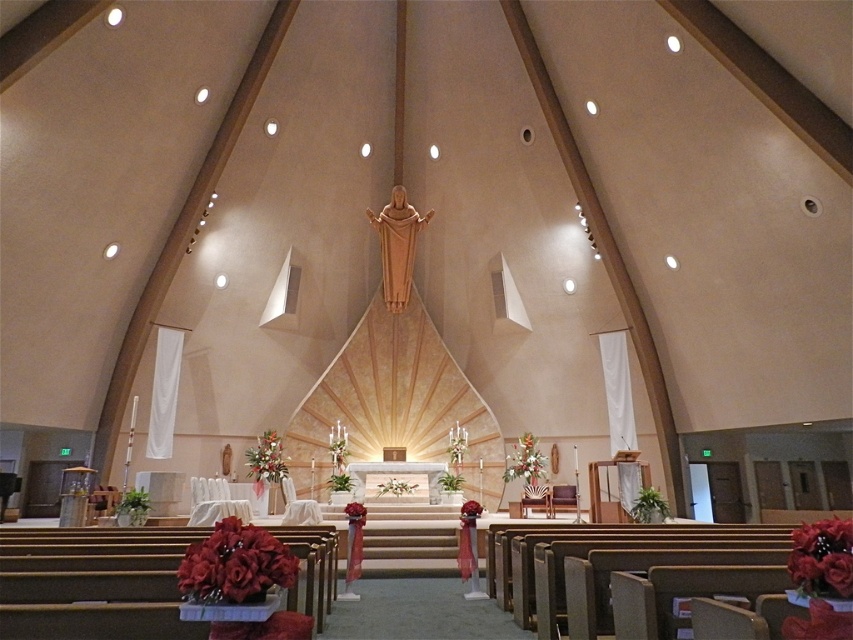
Which is behind, point (265, 572) or point (508, 480)?

The point (508, 480) is more distant.

Which is in front, point (219, 600) or point (520, 440)?

Positioned in front is point (219, 600).

Identify the location of velvety red bouquet at lower left. (234, 564).

In the scene shown: Between velvety red bouquet at lower left and silky red roses at lower right, which one has less height?

Standing shorter between the two is velvety red bouquet at lower left.

Who is positioned more to the left, velvety red bouquet at lower left or silky red roses at lower right?

velvety red bouquet at lower left

The image size is (853, 640). Describe the element at coordinates (234, 564) in the screenshot. I see `velvety red bouquet at lower left` at that location.

At what (x,y) coordinates should I click in order to perform the action: click on velvety red bouquet at lower left. Please return your answer as a coordinate pair (x, y). Image resolution: width=853 pixels, height=640 pixels. Looking at the image, I should click on (234, 564).

Between point (837, 577) and point (257, 461), which one is positioned behind?

The point (257, 461) is more distant.

Does silky red roses at lower right have a greater height compared to white silk flowers at lower center?

Incorrect, silky red roses at lower right's height is not larger of white silk flowers at lower center's.

Is point (831, 573) positioned after point (282, 465)?

No, (831, 573) is closer to viewer.

You are a GUI agent. You are given a task and a screenshot of the screen. Output one action in this format:
    pyautogui.click(x=<x>, y=<y>)
    Task: Click on the silky red roses at lower right
    Image resolution: width=853 pixels, height=640 pixels.
    Given the screenshot: What is the action you would take?
    pyautogui.click(x=822, y=557)